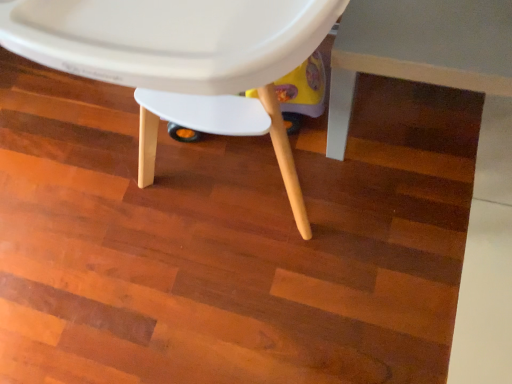
This screenshot has height=384, width=512. Identify the location of vacant area situated below white matte table at lower right (from a real-world perspective). (419, 122).